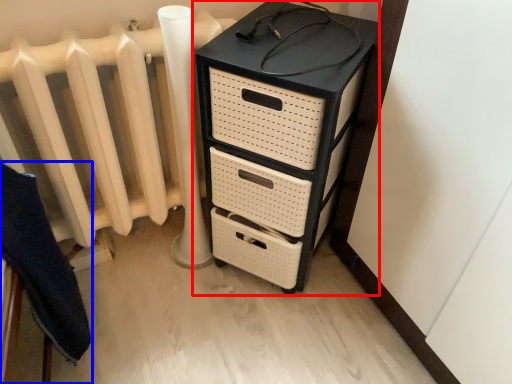
Question: Which point is closer to the camera, chest of drawers (highlighted by a red box) or furniture (highlighted by a blue box)?

Choices:
 (A) chest of drawers
 (B) furniture

Answer: (B)